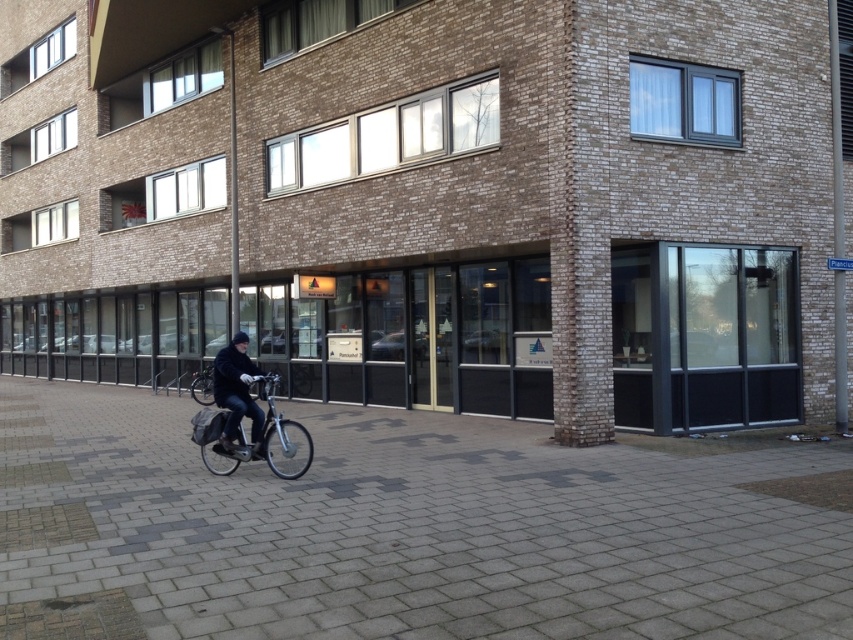
Question: Observing the image, what is the correct spatial positioning of silver metallic bicycle at lower left in reference to dark blue jacket at center?

Choices:
 (A) left
 (B) right

Answer: (B)

Question: Observing the image, what is the correct spatial positioning of silver metallic bicycle at lower left in reference to dark blue jacket at center?

Choices:
 (A) below
 (B) above

Answer: (A)

Question: Is silver metallic bicycle at lower left closer to the viewer compared to dark blue jacket at center?

Choices:
 (A) yes
 (B) no

Answer: (A)

Question: Which point is farther to the camera?

Choices:
 (A) (231, 452)
 (B) (218, 387)

Answer: (B)

Question: Which point appears closest to the camera in this image?

Choices:
 (A) (241, 332)
 (B) (259, 376)

Answer: (B)